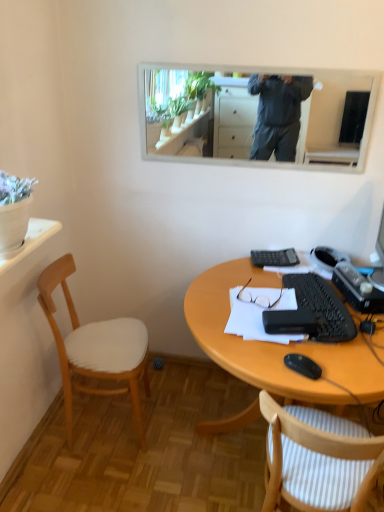
Image resolution: width=384 pixels, height=512 pixels. I want to click on free area in between wooden chair with white cushion at left, which is counted as the 1th chair, starting from the left, and white striped fabric chair at lower right, which is the 1th chair from right to left, so click(x=176, y=465).